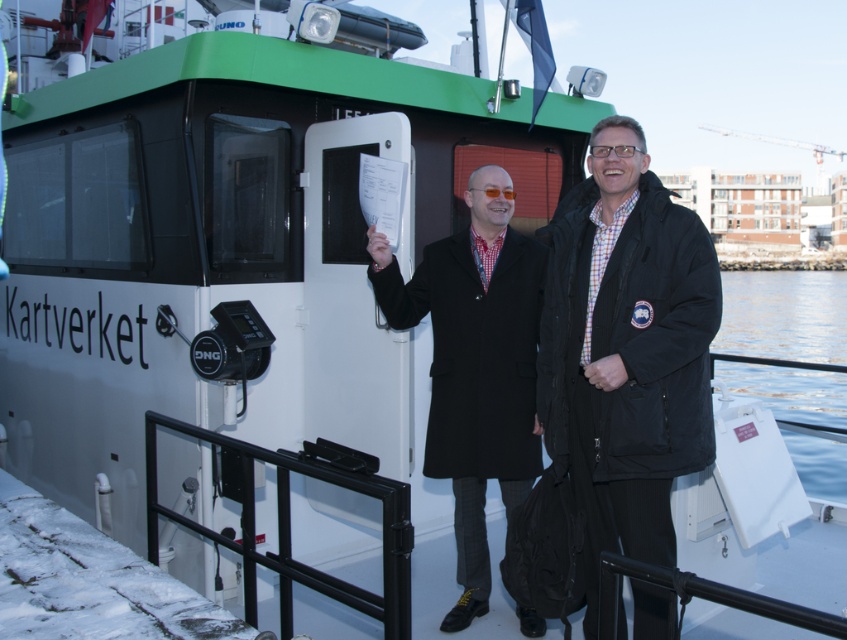
Find the location of a particular element. black wool coat at center is located at coordinates (626, 349).

Is black wool coat at center above matte black coat at center?

Yes, black wool coat at center is above matte black coat at center.

Does point (585, 534) come closer to viewer compared to point (515, 445)?

That is True.

Locate an element on the screen. This screenshot has width=847, height=640. black wool coat at center is located at coordinates (626, 349).

Is matte black coat at center closer to the viewer compared to clear water at lower right?

That is False.

Between matte black coat at center and clear water at lower right, which one appears on the right side from the viewer's perspective?

From the viewer's perspective, clear water at lower right appears more on the right side.

What do you see at coordinates (475, 364) in the screenshot? I see `matte black coat at center` at bounding box center [475, 364].

Where is `matte black coat at center`? This screenshot has width=847, height=640. matte black coat at center is located at coordinates (475, 364).

What do you see at coordinates (626, 349) in the screenshot? I see `black wool coat at center` at bounding box center [626, 349].

I want to click on black wool coat at center, so click(626, 349).